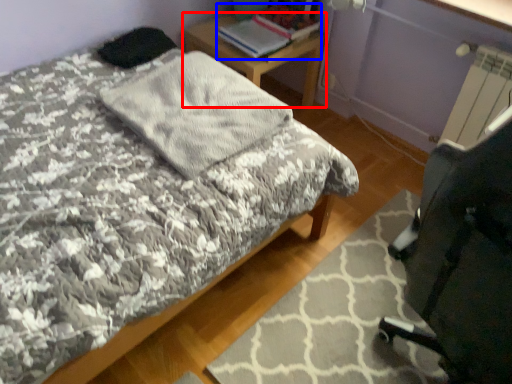
Question: Which object is closer to the camera taking this photo, desk (highlighted by a red box) or book (highlighted by a blue box)?

Choices:
 (A) desk
 (B) book

Answer: (B)